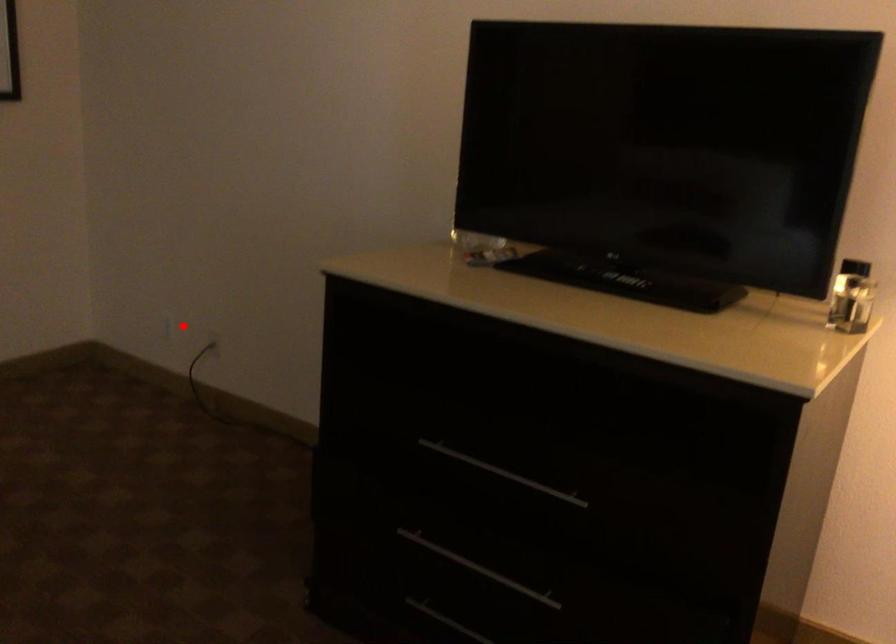
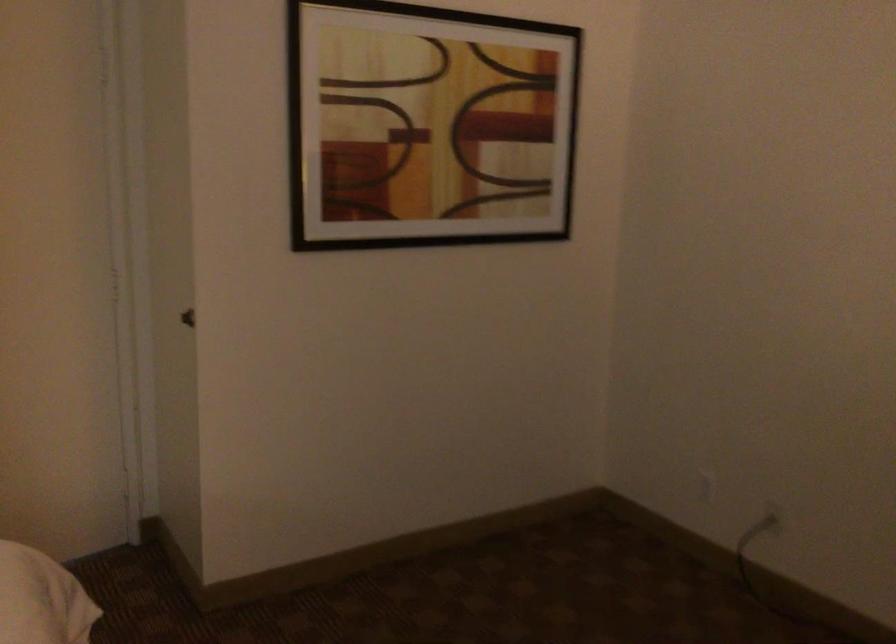
The point at the highlighted location is marked in the first image. Where is the corresponding point in the second image?

(707, 487)